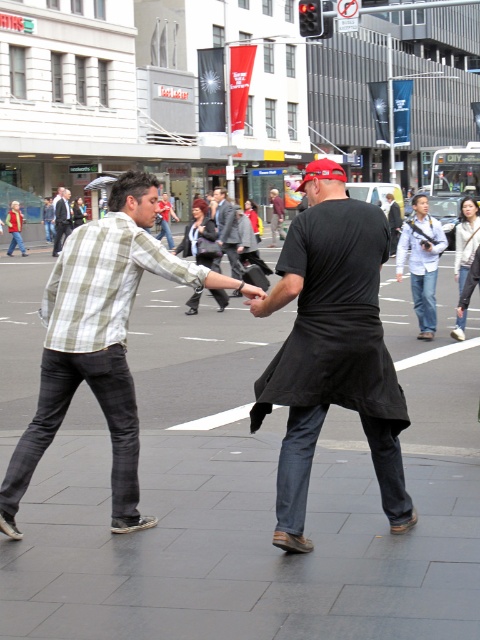
You are a photographer standing at the center of the street. You want to take a photo of the black matte shirt at center. Where should you aim your camera to capture it?

The black matte shirt at center is located at the coordinates point (332,348), so you should aim your camera at that position to capture it.

You are a photographer trying to capture a candid shot of both the black matte shirt at center and the black cotton shirt at center in the same frame. Given that your camera has a fixed focal length and the shirts are of different widths, which shirt should you focus on to ensure both are fully visible in the frame?

The black matte shirt at center has a smaller width than the black cotton shirt at center. To ensure both are fully visible in the frame, focus on the black cotton shirt at center since it is wider and will require more space in the composition.

You are a delivery drone operator who needs to land your drone on a flat surface. The drone has a GPS coordinate of point (252, 496). Based on the scene, what type of surface is at that coordinate?

The point (252, 496) corresponds to black asphalt at center, which is a flat surface suitable for landing the drone.